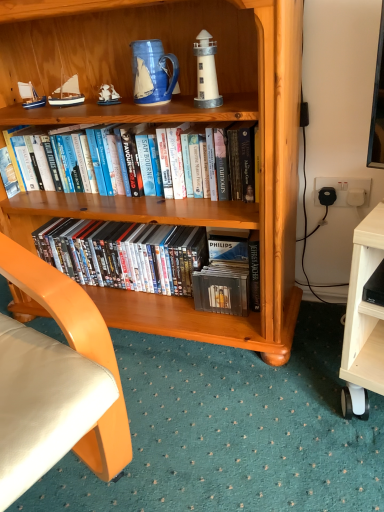
You are a GUI agent. You are given a task and a screenshot of the screen. Output one action in this format:
    pyautogui.click(x=<x>, y=<y>)
    Task: Click on the blue matte sailboat at upper left, acting as the second sailboat starting from the right
    This screenshot has width=384, height=512.
    Given the screenshot: What is the action you would take?
    pyautogui.click(x=30, y=96)

Measure the distance between wooden bookcase at center and camera.

wooden bookcase at center is 30.78 inches away from camera.

What do you see at coordinates (175, 122) in the screenshot? This screenshot has width=384, height=512. I see `wooden bookcase at center` at bounding box center [175, 122].

This screenshot has height=512, width=384. In order to click on white matte lighthouse at upper center in this screenshot , I will do `click(206, 72)`.

What is the approximate width of blue ceramic mug at upper center?

The width of blue ceramic mug at upper center is 3.92 inches.

Image resolution: width=384 pixels, height=512 pixels. What do you see at coordinates (108, 95) in the screenshot?
I see `white matte ship at upper left` at bounding box center [108, 95].

Locate an element on the screen. blue matte sailboat at upper left, acting as the second sailboat starting from the right is located at coordinates (30, 96).

Which point is more distant from viewer, (57, 99) or (138, 63)?

The point (57, 99) is farther from the camera.

Is wooden sailboat at upper left, the 1th sailboat when ordered from right to left, thinner than blue ceramic mug at upper center?

Yes, wooden sailboat at upper left, the 1th sailboat when ordered from right to left, is thinner than blue ceramic mug at upper center.

How different are the orientations of wooden sailboat at upper left, which is the 2th sailboat from left to right, and blue ceramic mug at upper center in degrees?

They differ by 0.000309 degrees in their facing directions.

Is the surface of wooden sailboat at upper left, which is the 2th sailboat from left to right, in direct contact with blue ceramic mug at upper center?

They are not placed beside each other.

Could wooden bookcase at center be considered to be inside blue ceramic mug at upper center?

No.

From a real-world perspective, which is physically above, blue ceramic mug at upper center or wooden bookcase at center?

blue ceramic mug at upper center.

Is blue ceramic mug at upper center touching wooden bookcase at center?

blue ceramic mug at upper center is not next to wooden bookcase at center, and they're not touching.

Between blue ceramic mug at upper center and wooden bookcase at center, which one has less height?

With less height is blue ceramic mug at upper center.

Would you say wooden bookcase at center is a long distance from blue matte sailboat at upper left, acting as the second sailboat starting from the right?

No, wooden bookcase at center is in close proximity to blue matte sailboat at upper left, acting as the second sailboat starting from the right.

Is wooden bookcase at center inside or outside of blue matte sailboat at upper left, which is the first sailboat in left-to-right order?

wooden bookcase at center exists outside the volume of blue matte sailboat at upper left, which is the first sailboat in left-to-right order.

Based on the photo, which of these two, wooden bookcase at center or blue matte sailboat at upper left, which is the first sailboat in left-to-right order, is wider?

wooden bookcase at center.

Consider the image. Considering the relative sizes of wooden bookcase at center and blue matte sailboat at upper left, acting as the second sailboat starting from the right, in the image provided, is wooden bookcase at center shorter than blue matte sailboat at upper left, acting as the second sailboat starting from the right,?

No.

Who is shorter, white matte ship at upper left or metallic silver dvds at lower center, marked as the 1th book in a bottom-to-top arrangement?

white matte ship at upper left.

Which of these two, white matte ship at upper left or metallic silver dvds at lower center, marked as the 1th book in a bottom-to-top arrangement, is wider?

metallic silver dvds at lower center, marked as the 1th book in a bottom-to-top arrangement.

Which is in front, point (112, 96) or point (79, 254)?

Point (112, 96)

From a real-world perspective, is white matte ship at upper left positioned over metallic silver dvds at lower center, marked as the 1th book in a bottom-to-top arrangement, based on gravity?

Yes.

Is white matte ship at upper left closer to camera compared to blue ceramic mug at upper center?

No, it is not.

From the image's perspective, is white matte ship at upper left below blue ceramic mug at upper center?

Yes, from the image's perspective, white matte ship at upper left is below blue ceramic mug at upper center.

Is white matte ship at upper left taller than blue ceramic mug at upper center?

Incorrect, the height of white matte ship at upper left is not larger of that of blue ceramic mug at upper center.

In the scene shown: Which of these two, blue ceramic mug at upper center or metallic silver dvds at lower center, marked as the 1th book in a bottom-to-top arrangement, is wider?

metallic silver dvds at lower center, marked as the 1th book in a bottom-to-top arrangement.

Considering the relative sizes of blue ceramic mug at upper center and metallic silver dvds at lower center, which is the second book from top to bottom, in the image provided, is blue ceramic mug at upper center taller than metallic silver dvds at lower center, which is the second book from top to bottom,?

Incorrect, the height of blue ceramic mug at upper center is not larger of that of metallic silver dvds at lower center, which is the second book from top to bottom.

Looking at the image, does blue ceramic mug at upper center seem bigger or smaller compared to metallic silver dvds at lower center, marked as the 1th book in a bottom-to-top arrangement?

Considering their sizes, blue ceramic mug at upper center takes up less space than metallic silver dvds at lower center, marked as the 1th book in a bottom-to-top arrangement.

Is blue ceramic mug at upper center far from metallic silver dvds at lower center, marked as the 1th book in a bottom-to-top arrangement?

That's not correct — blue ceramic mug at upper center is a little close to metallic silver dvds at lower center, marked as the 1th book in a bottom-to-top arrangement.

Measure the distance between white matte lighthouse at upper center and hardcover books at center, which is the 2th book in bottom-to-top order.

A: The distance of white matte lighthouse at upper center from hardcover books at center, which is the 2th book in bottom-to-top order, is 11.51 inches.

In terms of height, does white matte lighthouse at upper center look taller or shorter compared to hardcover books at center, which is the 2th book in bottom-to-top order?

In the image, white matte lighthouse at upper center appears to be shorter than hardcover books at center, which is the 2th book in bottom-to-top order.

Considering the positions of points (221, 100) and (10, 130), is point (221, 100) farther from camera compared to point (10, 130)?

That is False.

Is there a large distance between white matte lighthouse at upper center and hardcover books at center, positioned as the first book in top-to-bottom order?

They are positioned close to each other.

You are a GUI agent. You are given a task and a screenshot of the screen. Output one action in this format:
    pyautogui.click(x=<x>, y=<y>)
    Task: Click on the coffee cup in front of the wooden sailboat at upper left, which is the 2th sailboat from left to right
    This screenshot has width=384, height=512.
    Given the screenshot: What is the action you would take?
    pyautogui.click(x=152, y=72)

Where is `coffee cup above the wooden bookcase at center (from the image's perspective)`? The width and height of the screenshot is (384, 512). coffee cup above the wooden bookcase at center (from the image's perspective) is located at coordinates (152, 72).

Which object lies nearer to the anchor point wooden bookcase at center, blue matte sailboat at upper left, which is the first sailboat in left-to-right order, or metallic silver dvds at lower center, which is the second book from top to bottom?

metallic silver dvds at lower center, which is the second book from top to bottom, is positioned closer to the anchor wooden bookcase at center.

Based on their spatial positions, is white matte ship at upper left or white matte lighthouse at upper center closer to metallic silver dvds at lower center, marked as the 1th book in a bottom-to-top arrangement?

Based on the image, white matte ship at upper left appears to be nearer to metallic silver dvds at lower center, marked as the 1th book in a bottom-to-top arrangement.

Which object lies further to the anchor point hardcover books at center, which is the 2th book in bottom-to-top order, blue matte sailboat at upper left, which is the first sailboat in left-to-right order, or metallic silver dvds at lower center, marked as the 1th book in a bottom-to-top arrangement?

blue matte sailboat at upper left, which is the first sailboat in left-to-right order, lies further to hardcover books at center, which is the 2th book in bottom-to-top order, than the other object.

Looking at the image, which one is located closer to white matte lighthouse at upper center, metallic silver dvds at lower center, which is the second book from top to bottom, or hardcover books at center, positioned as the first book in top-to-bottom order?

hardcover books at center, positioned as the first book in top-to-bottom order, is closer to white matte lighthouse at upper center.

Considering their positions, is wooden sailboat at upper left, the 1th sailboat when ordered from right to left, positioned further to white matte lighthouse at upper center than blue matte sailboat at upper left, which is the first sailboat in left-to-right order?

Based on the image, blue matte sailboat at upper left, which is the first sailboat in left-to-right order, appears to be further to white matte lighthouse at upper center.

Considering their positions, is hardcover books at center, positioned as the first book in top-to-bottom order, positioned further to wooden sailboat at upper left, the 1th sailboat when ordered from right to left, than blue matte sailboat at upper left, acting as the second sailboat starting from the right?

Based on the image, hardcover books at center, positioned as the first book in top-to-bottom order, appears to be further to wooden sailboat at upper left, the 1th sailboat when ordered from right to left.

In the scene shown: Based on their spatial positions, is wooden sailboat at upper left, the 1th sailboat when ordered from right to left, or blue matte sailboat at upper left, acting as the second sailboat starting from the right, further from metallic silver dvds at lower center, which is the second book from top to bottom?

blue matte sailboat at upper left, acting as the second sailboat starting from the right, is positioned further to the anchor metallic silver dvds at lower center, which is the second book from top to bottom.

From the picture: When comparing their distances from blue ceramic mug at upper center, does white matte lighthouse at upper center or wooden sailboat at upper left, the 1th sailboat when ordered from right to left, seem further?

The object further to blue ceramic mug at upper center is wooden sailboat at upper left, the 1th sailboat when ordered from right to left.

In order to click on toy between wooden bookcase at center and metallic silver dvds at lower center, which is the second book from top to bottom, along the z-axis in this screenshot , I will do `click(108, 95)`.

In order to click on sailboat between blue matte sailboat at upper left, which is the first sailboat in left-to-right order, and blue ceramic mug at upper center, in the horizontal direction in this screenshot , I will do `click(67, 94)`.

Image resolution: width=384 pixels, height=512 pixels. Find the location of `toy located between blue matte sailboat at upper left, which is the first sailboat in left-to-right order, and white matte lighthouse at upper center in the left-right direction`. toy located between blue matte sailboat at upper left, which is the first sailboat in left-to-right order, and white matte lighthouse at upper center in the left-right direction is located at coordinates (108, 95).

The height and width of the screenshot is (512, 384). In order to click on book positioned between wooden bookcase at center and white matte ship at upper left from near to far in this screenshot , I will do `click(139, 167)`.